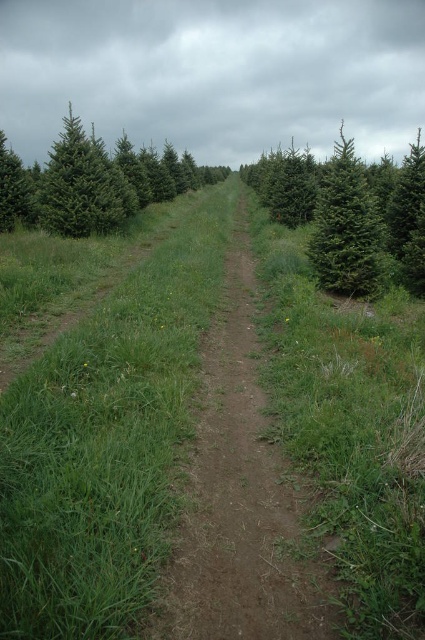
You are a gardener planning to plant additional flowers in the field. Given the space occupied by the green grassy at center and the green matte evergreen tree at right, which area would allow for more flower planting?

The green matte evergreen tree at right occupies more space than the green grassy at center, so planting flowers in the green grassy at center area would allow for more flower planting.